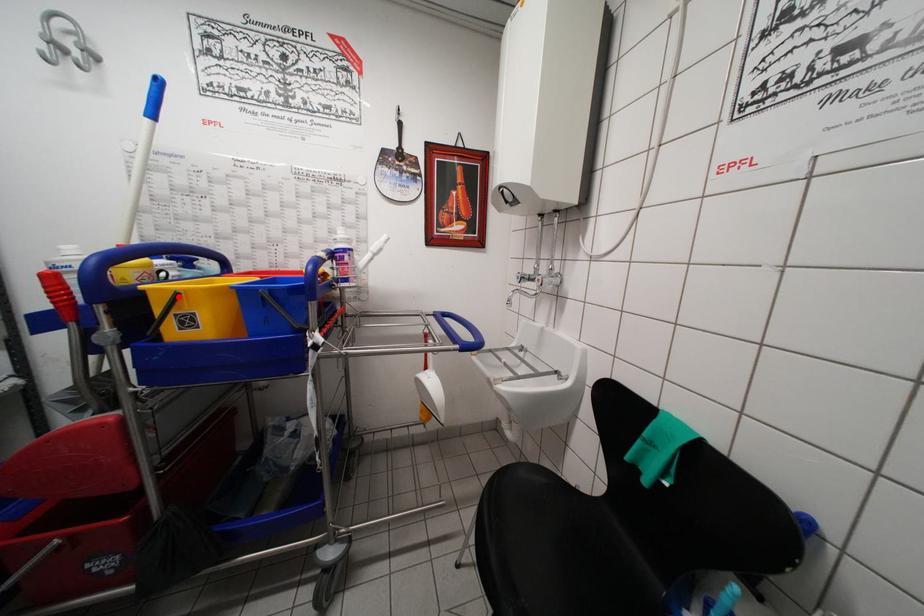
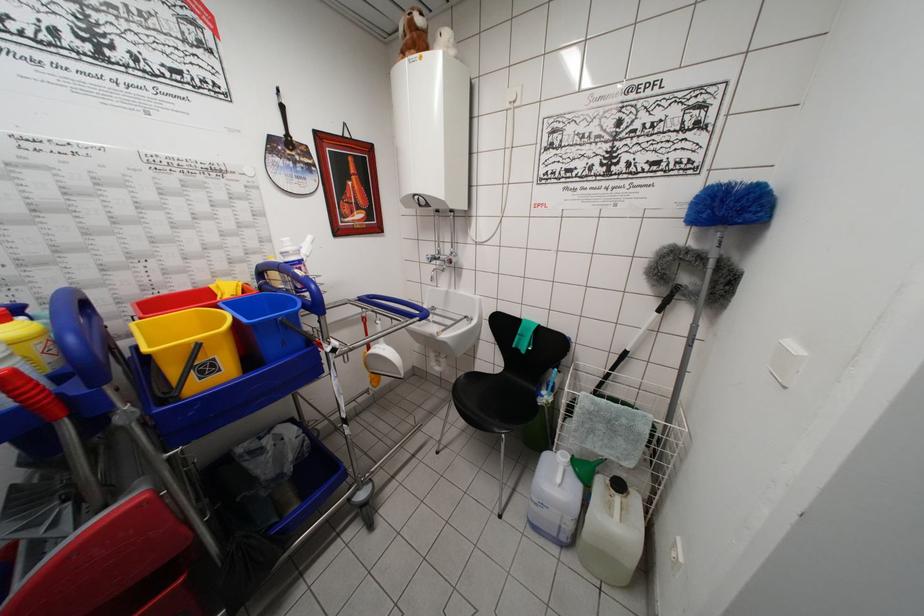
Find the pixel in the second image that matches the highlighted location in the first image.

(200, 349)